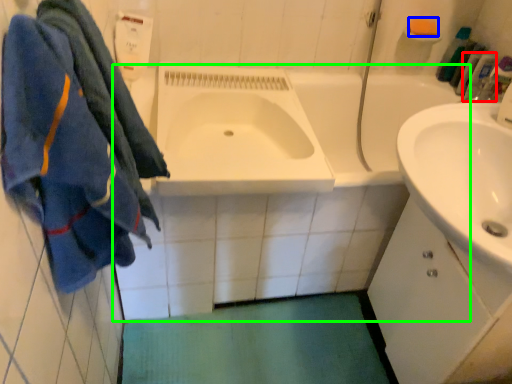
Question: Considering the real-world distances, which object is farthest from toiletry (highlighted by a red box)? soap (highlighted by a blue box) or bath (highlighted by a green box)?

Choices:
 (A) soap
 (B) bath

Answer: (B)